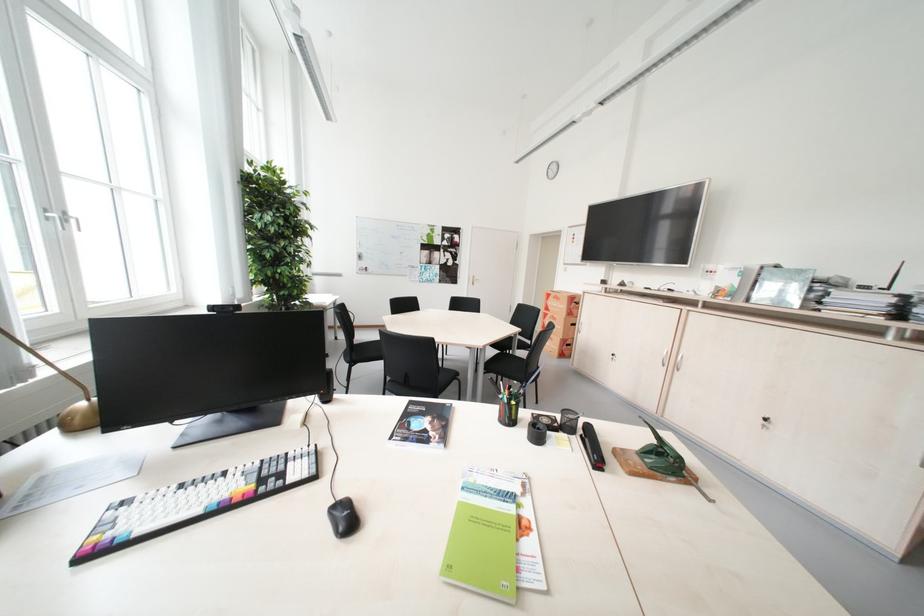
The height and width of the screenshot is (616, 924). Describe the element at coordinates (479, 286) in the screenshot. I see `the white door handle` at that location.